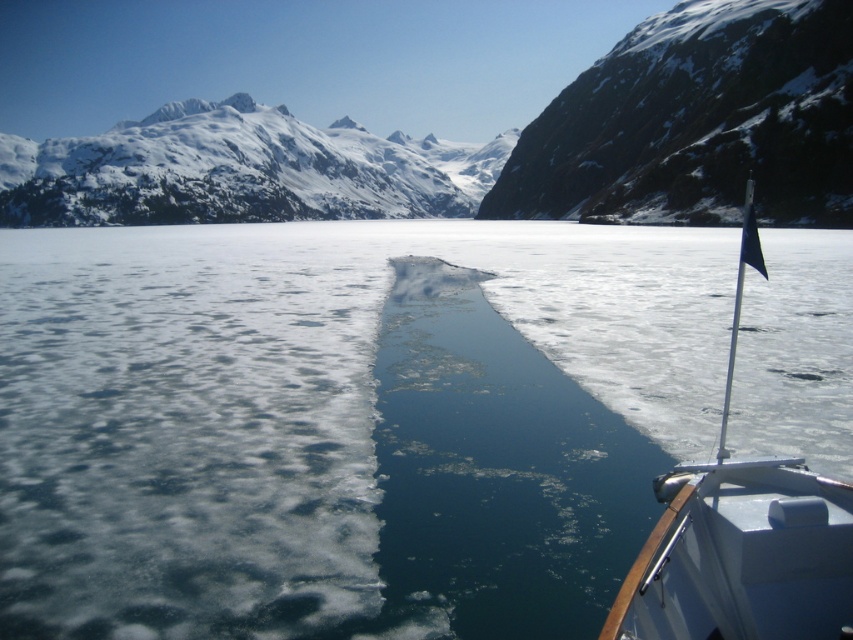
You are an observer standing at the edge of the frozen lake. You notice the snowy rocky mountain at upper center and the white glossy boat at right. Which object appears wider from your viewpoint?

The snowy rocky mountain at upper center appears wider than the white glossy boat at right from your viewpoint because its width surpasses that of the boat.

You are an explorer trying to cross the frozen lake. You see the clear ice at center and the dark gray rocky cliff at upper right. Which one is taller from your viewpoint?

The dark gray rocky cliff at upper right is taller than the clear ice at center.

You are a drone operator tasked with capturing aerial footage of the dark gray rocky cliff at upper right and the white glossy boat at right. The drone has a maximum range of 80 meters. Can you fly the drone from the cliff to the boat without exceeding its range?

The dark gray rocky cliff at upper right and the white glossy boat at right are 77.11 meters apart from each other. Since the drone has a maximum range of 80 meters, it can safely fly from the cliff to the boat without exceeding its range.